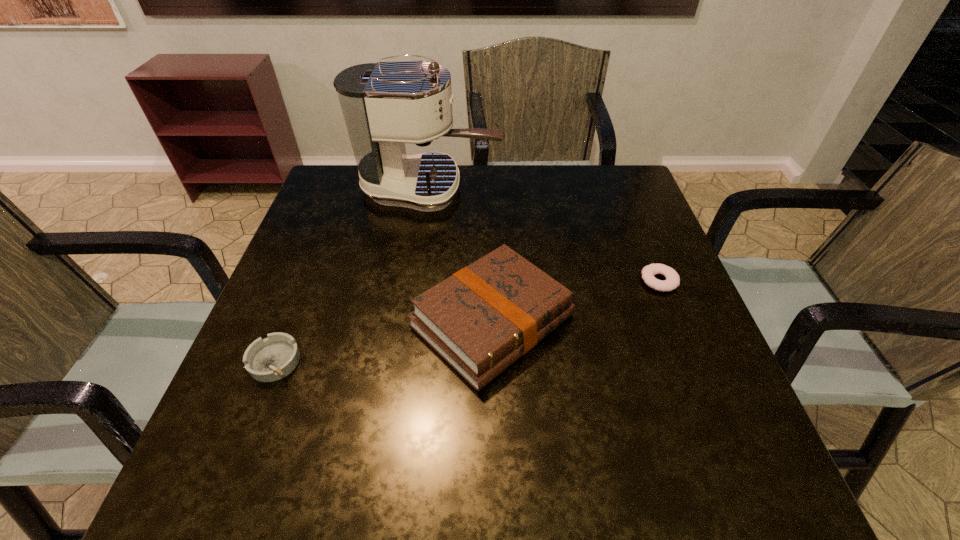
The height and width of the screenshot is (540, 960). Identify the location of coffee maker. (386, 104).

Locate an element on the screen. Image resolution: width=960 pixels, height=540 pixels. the farthest object is located at coordinates (386, 104).

In order to click on the second tallest object in this screenshot , I will do `click(483, 318)`.

Where is `the leftmost object`? The image size is (960, 540). the leftmost object is located at coordinates (273, 358).

Identify the location of ashtray. The image size is (960, 540). click(x=273, y=358).

This screenshot has height=540, width=960. I want to click on the rightmost object, so click(672, 281).

This screenshot has height=540, width=960. I want to click on doughnut, so click(672, 281).

You are a GUI agent. You are given a task and a screenshot of the screen. Output one action in this format:
    pyautogui.click(x=<x>, y=<y>)
    Task: Click on the vacant region located on the front-facing side of the farthest object
    The height and width of the screenshot is (540, 960).
    Given the screenshot: What is the action you would take?
    pyautogui.click(x=587, y=189)

At what (x,y) coordinates should I click in order to perform the action: click on free space located on the back of the hardback book. Please return your answer as a coordinate pair (x, y). The height and width of the screenshot is (540, 960). Looking at the image, I should click on (491, 239).

In order to click on free point located on the right of the third tallest object in this screenshot , I will do `click(456, 361)`.